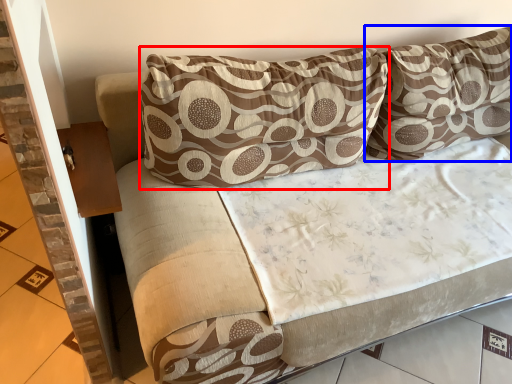
Question: Which of the following is the farthest to the observer, pillow (highlighted by a red box) or pillow (highlighted by a blue box)?

Choices:
 (A) pillow
 (B) pillow

Answer: (B)